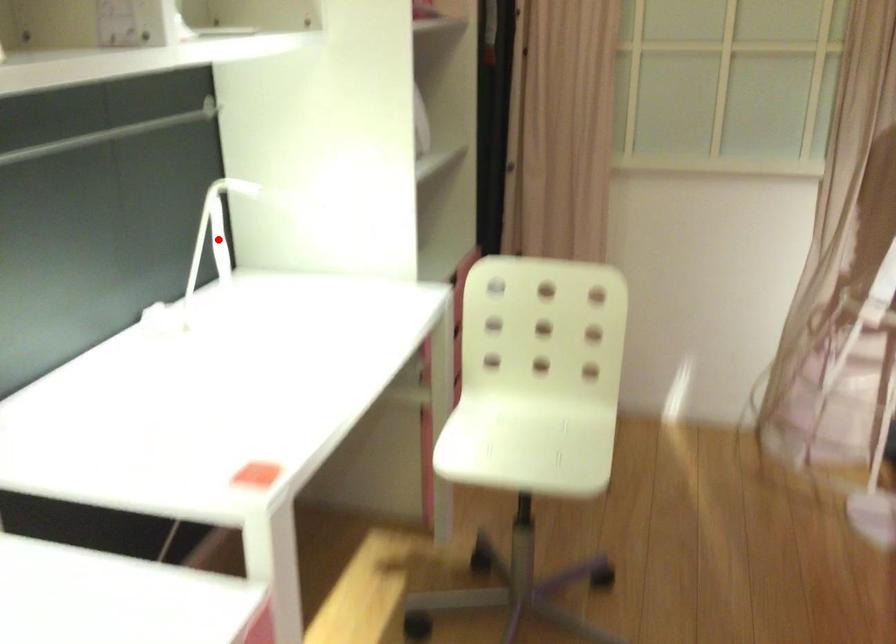
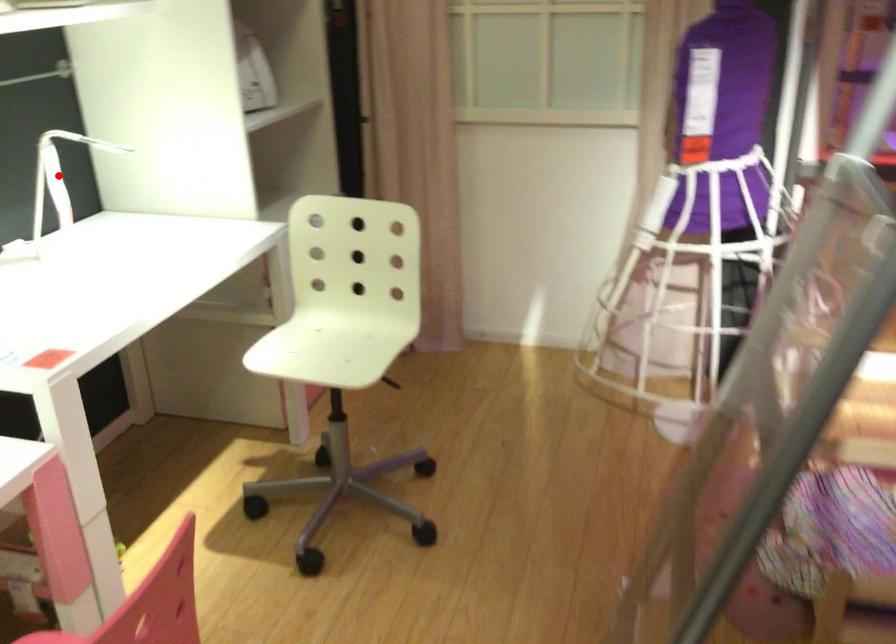
I am providing you with two images of the same scene from different viewpoints. A red point is marked on the first image and another point is marked on the second image. Do the highlighted points in image1 and image2 indicate the same real-world spot?

Yes